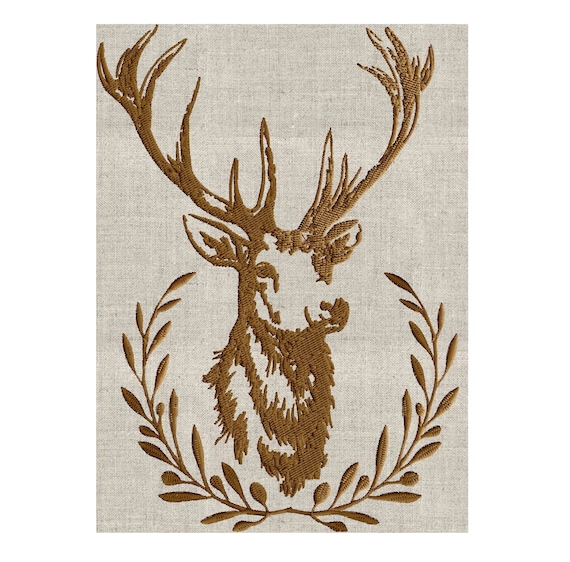
The height and width of the screenshot is (562, 570). I want to click on chest, so click(287, 424).